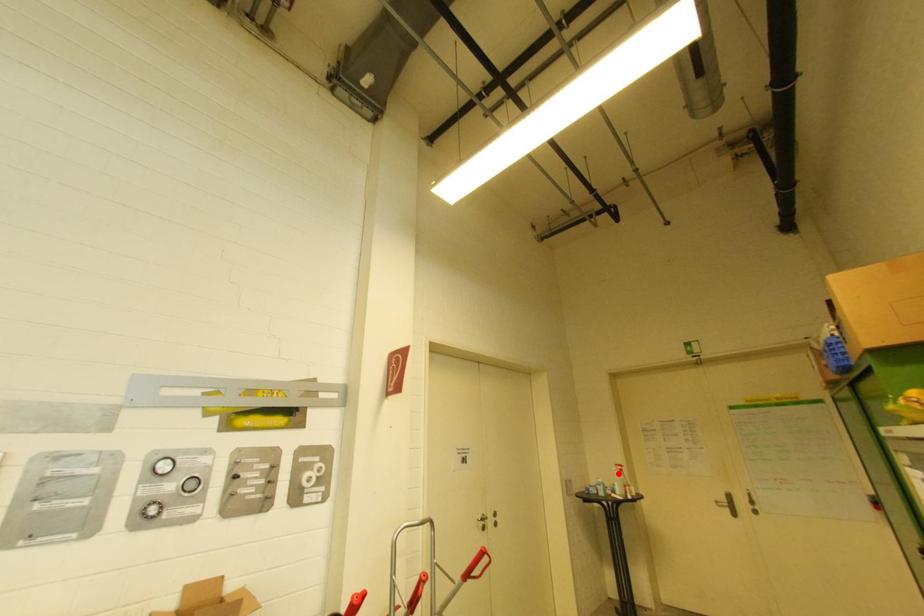
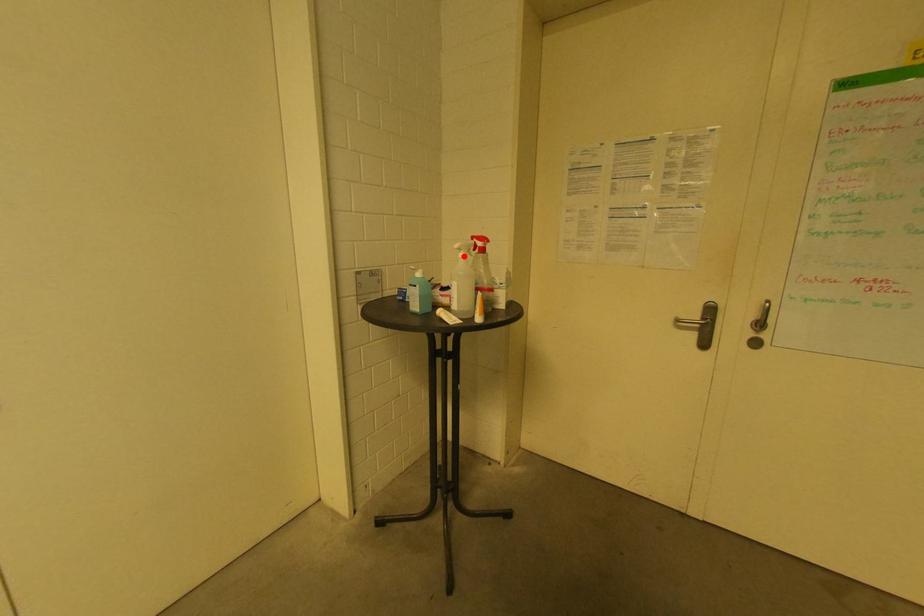
I am providing you with two images of the same scene from different viewpoints. A red point is marked on the first image and another point is marked on the second image. Do the highlighted points in image1 and image2 indicate the same real-world spot?

Yes